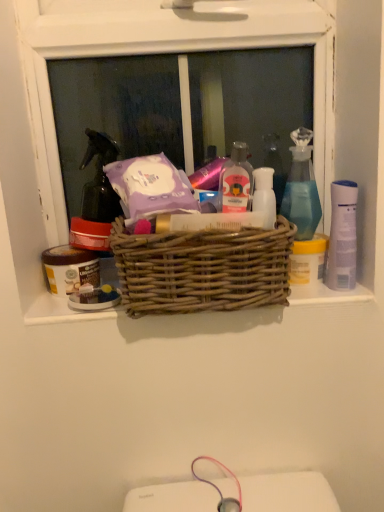
Question: From a real-world perspective, is white plastic bottle at center, acting as the third toiletry starting from the left, on woven wood basket at center?

Choices:
 (A) yes
 (B) no

Answer: (A)

Question: Is white plastic bottle at center, marked as the 2th toiletry in a front-to-back arrangement, touching woven wood basket at center?

Choices:
 (A) yes
 (B) no

Answer: (B)

Question: Considering the relative positions of white plastic bottle at center, the first toiletry positioned from the right, and woven wood basket at center in the image provided, is white plastic bottle at center, the first toiletry positioned from the right, to the left of woven wood basket at center from the viewer's perspective?

Choices:
 (A) no
 (B) yes

Answer: (A)

Question: Does white plastic bottle at center, marked as the 2th toiletry in a front-to-back arrangement, have a greater height compared to woven wood basket at center?

Choices:
 (A) yes
 (B) no

Answer: (B)

Question: From a real-world perspective, does white plastic bottle at center, marked as the 2th toiletry in a front-to-back arrangement, sit lower than woven wood basket at center?

Choices:
 (A) yes
 (B) no

Answer: (B)

Question: From the image's perspective, is translucent glass spray bottle at upper right above or below translucent plastic bottle at center, positioned as the second toiletry in left-to-right order?

Choices:
 (A) below
 (B) above

Answer: (B)

Question: Based on their sizes in the image, would you say translucent glass spray bottle at upper right is bigger or smaller than translucent plastic bottle at center, positioned as the second toiletry in left-to-right order?

Choices:
 (A) big
 (B) small

Answer: (A)

Question: Does point (299, 232) appear closer or farther from the camera than point (226, 194)?

Choices:
 (A) closer
 (B) farther

Answer: (B)

Question: Is translucent glass spray bottle at upper right in front of or behind translucent plastic bottle at center, positioned as the second toiletry in left-to-right order, in the image?

Choices:
 (A) behind
 (B) front

Answer: (A)

Question: From their relative heights in the image, would you say matte brown jar at left, marked as the 3th toiletry in a right-to-left arrangement, is taller or shorter than white plastic mouthwash at right?

Choices:
 (A) short
 (B) tall

Answer: (A)

Question: From a real-world perspective, is matte brown jar at left, acting as the first toiletry starting from the back, physically located above or below white plastic mouthwash at right?

Choices:
 (A) above
 (B) below

Answer: (B)

Question: Considering the relative positions of matte brown jar at left, which is the 3th toiletry from front to back, and white plastic mouthwash at right in the image provided, is matte brown jar at left, which is the 3th toiletry from front to back, to the left or to the right of white plastic mouthwash at right?

Choices:
 (A) left
 (B) right

Answer: (A)

Question: In the image, is matte brown jar at left, which is the 3th toiletry from front to back, positioned in front of or behind white plastic mouthwash at right?

Choices:
 (A) behind
 (B) front

Answer: (A)

Question: In terms of height, does white plastic mouthwash at right look taller or shorter compared to white plastic bottle at center, marked as the 2th toiletry in a front-to-back arrangement?

Choices:
 (A) tall
 (B) short

Answer: (A)

Question: Choose the correct answer: Is white plastic mouthwash at right inside white plastic bottle at center, marked as the 2th toiletry in a front-to-back arrangement, or outside it?

Choices:
 (A) inside
 (B) outside

Answer: (B)